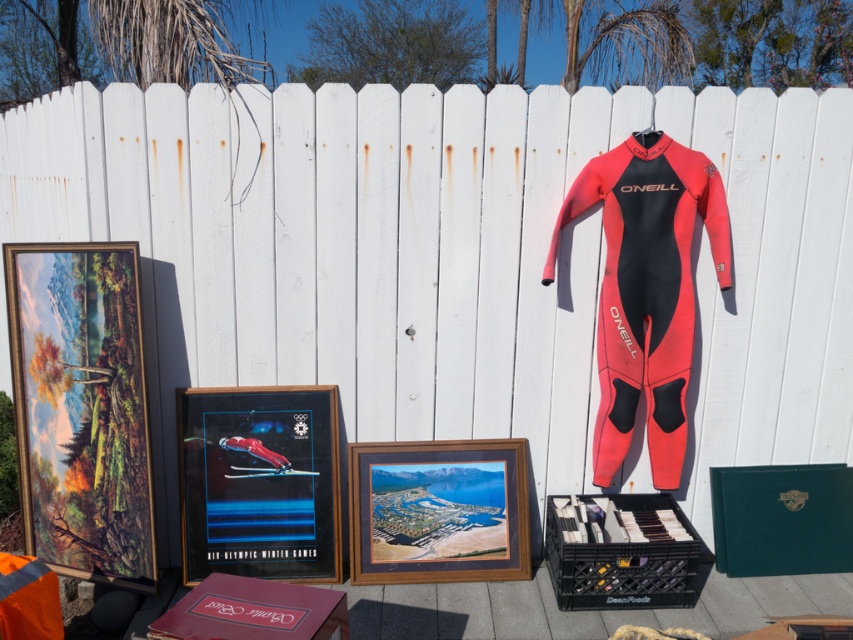
Question: Which point is closer to the camera?

Choices:
 (A) (496, 536)
 (B) (187, 461)
 (C) (51, 314)
 (D) (689, 284)

Answer: (C)

Question: Which object is the farthest from the wooden framed photo at center?

Choices:
 (A) matte plastic picture frame at center
 (B) matte wooden picture frame at left

Answer: (B)

Question: Is matte wooden picture frame at left closer to the viewer compared to red neoprene wetsuit at right?

Choices:
 (A) no
 (B) yes

Answer: (B)

Question: Based on their relative distances, which object is farther from the matte plastic picture frame at center?

Choices:
 (A) wooden framed photo at center
 (B) matte wooden picture frame at left

Answer: (B)

Question: Does red neoprene wetsuit at right appear under wooden framed photo at center?

Choices:
 (A) no
 (B) yes

Answer: (A)

Question: Is red neoprene wetsuit at right below wooden framed photo at center?

Choices:
 (A) yes
 (B) no

Answer: (B)